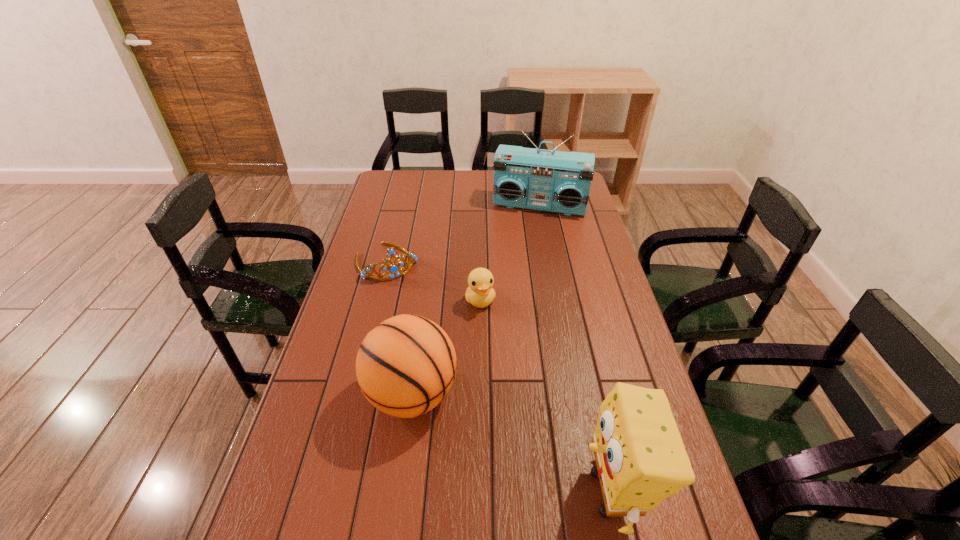
Where is `vacant space on the desktop that is between the basketball and the sponge and is positioned on the front-facing side of the tiara`? The height and width of the screenshot is (540, 960). vacant space on the desktop that is between the basketball and the sponge and is positioned on the front-facing side of the tiara is located at coordinates (488, 431).

The width and height of the screenshot is (960, 540). I want to click on free space on the desktop that is between the basketball and the sponge and is positioned on the front-facing side of the radio receiver, so click(484, 430).

Locate an element on the screen. The image size is (960, 540). free space on the desktop that is between the second nearest object and the nearest object and is positioned on the face of the third object from left to right is located at coordinates (526, 451).